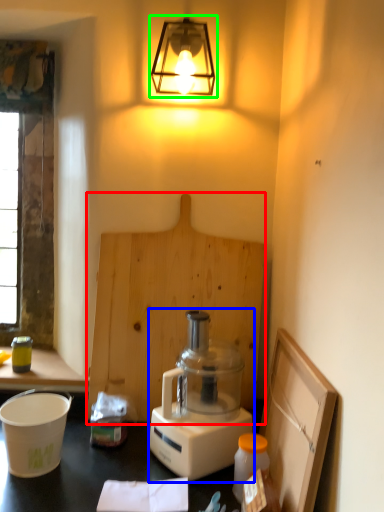
Question: Estimate the real-world distances between objects in this image. Which object is farther from plywood (highlighted by a red box), blender (highlighted by a blue box) or lamp (highlighted by a green box)?

Choices:
 (A) blender
 (B) lamp

Answer: (B)